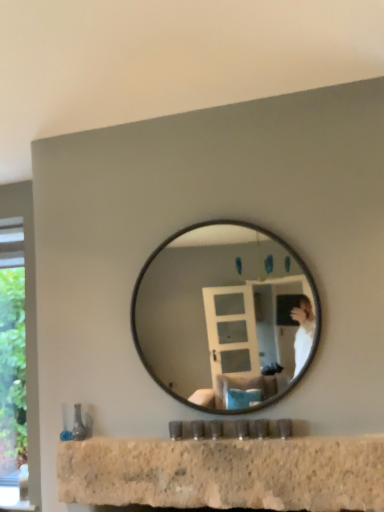
I want to click on granite countertop at lower center, so click(225, 472).

In order to face granite countertop at lower center, should I rotate leftwards or rightwards?

You should look right and rotate roughly 2.179 degrees.

The width and height of the screenshot is (384, 512). Describe the element at coordinates (225, 472) in the screenshot. I see `granite countertop at lower center` at that location.

The width and height of the screenshot is (384, 512). Describe the element at coordinates (225, 314) in the screenshot. I see `black glass mirror at center` at that location.

Measure the distance between black glass mirror at center and camera.

black glass mirror at center and camera are 5.54 feet apart from each other.

At what (x,y) coordinates should I click in order to perform the action: click on black glass mirror at center. Please return your answer as a coordinate pair (x, y). The width and height of the screenshot is (384, 512). Looking at the image, I should click on (225, 314).

At what (x,y) coordinates should I click in order to perform the action: click on granite countertop at lower center. Please return your answer as a coordinate pair (x, y). The height and width of the screenshot is (512, 384). Looking at the image, I should click on (225, 472).

Based on the photo, can you confirm if black glass mirror at center is positioned to the right of granite countertop at lower center?

Yes, black glass mirror at center is to the right of granite countertop at lower center.

Consider the image. Which object is more forward, black glass mirror at center or granite countertop at lower center?

Positioned in front is granite countertop at lower center.

Is point (157, 372) farther from viewer compared to point (259, 447)?

Yes, point (157, 372) is farther from viewer.

From the image's perspective, which is below, black glass mirror at center or granite countertop at lower center?

From the image's view, granite countertop at lower center is below.

Looking at this image, from a real-world perspective, is black glass mirror at center positioned over granite countertop at lower center based on gravity?

Correct, in the physical world, black glass mirror at center is higher than granite countertop at lower center.

Does black glass mirror at center have a greater width compared to granite countertop at lower center?

Correct, the width of black glass mirror at center exceeds that of granite countertop at lower center.

Can you confirm if black glass mirror at center is shorter than granite countertop at lower center?

Incorrect, the height of black glass mirror at center does not fall short of that of granite countertop at lower center.

Can you confirm if black glass mirror at center is bigger than granite countertop at lower center?

Correct, black glass mirror at center is larger in size than granite countertop at lower center.

Is black glass mirror at center inside the boundaries of granite countertop at lower center, or outside?

black glass mirror at center is outside granite countertop at lower center.

Is the surface of black glass mirror at center in direct contact with granite countertop at lower center?

black glass mirror at center and granite countertop at lower center are clearly separated.

Is black glass mirror at center oriented away from granite countertop at lower center?

That's not correct — black glass mirror at center is not looking away from granite countertop at lower center.

What's the angular difference between black glass mirror at center and granite countertop at lower center's facing directions?

The facing directions of black glass mirror at center and granite countertop at lower center are 0.001 degrees apart.

Find the location of a particular element. counter top located on the left of black glass mirror at center is located at coordinates (225, 472).

Considering the relative positions of granite countertop at lower center and black glass mirror at center in the image provided, is granite countertop at lower center to the left or to the right of black glass mirror at center?

granite countertop at lower center is to the left of black glass mirror at center.

Is granite countertop at lower center further to the viewer compared to black glass mirror at center?

No.

Is point (162, 450) farther from viewer compared to point (159, 343)?

No, it is not.

From the image's perspective, which is above, granite countertop at lower center or black glass mirror at center?

black glass mirror at center appears higher in the image.

From a real-world perspective, is granite countertop at lower center located beneath black glass mirror at center?

Yes, from a real-world perspective, granite countertop at lower center is under black glass mirror at center.

Looking at their sizes, would you say granite countertop at lower center is wider or thinner than black glass mirror at center?

In the image, granite countertop at lower center appears to be more narrow than black glass mirror at center.

Considering the relative sizes of granite countertop at lower center and black glass mirror at center in the image provided, is granite countertop at lower center taller than black glass mirror at center?

No.

Which of these two, granite countertop at lower center or black glass mirror at center, is bigger?

Bigger between the two is black glass mirror at center.

Can we say granite countertop at lower center lies outside black glass mirror at center?

granite countertop at lower center is positioned outside black glass mirror at center.

Are granite countertop at lower center and black glass mirror at center making contact?

No, granite countertop at lower center is not with black glass mirror at center.

Is granite countertop at lower center oriented towards black glass mirror at center?

No, granite countertop at lower center does not turn towards black glass mirror at center.

How many degrees apart are the facing directions of granite countertop at lower center and black glass mirror at center?

The angular difference between granite countertop at lower center and black glass mirror at center is 0.001 degrees.

Measure the distance from granite countertop at lower center to black glass mirror at center.

45.46 centimeters.

Identify the location of counter top that is in front of the black glass mirror at center. point(225,472).

I want to click on mirror above the granite countertop at lower center (from the image's perspective), so coord(225,314).

Identify the location of mirror above the granite countertop at lower center (from a real-world perspective). Image resolution: width=384 pixels, height=512 pixels. (225, 314).